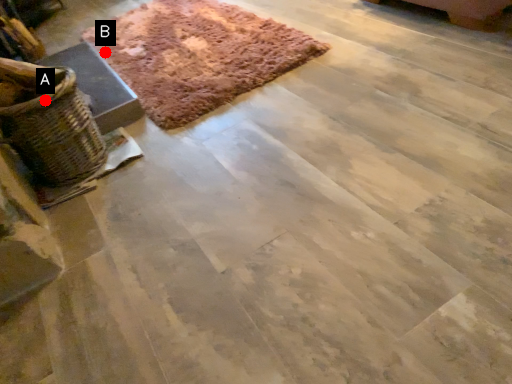
Question: Two points are circled on the image, labeled by A and B beside each circle. Which point is farther to the camera?

Choices:
 (A) A is further
 (B) B is further

Answer: (B)